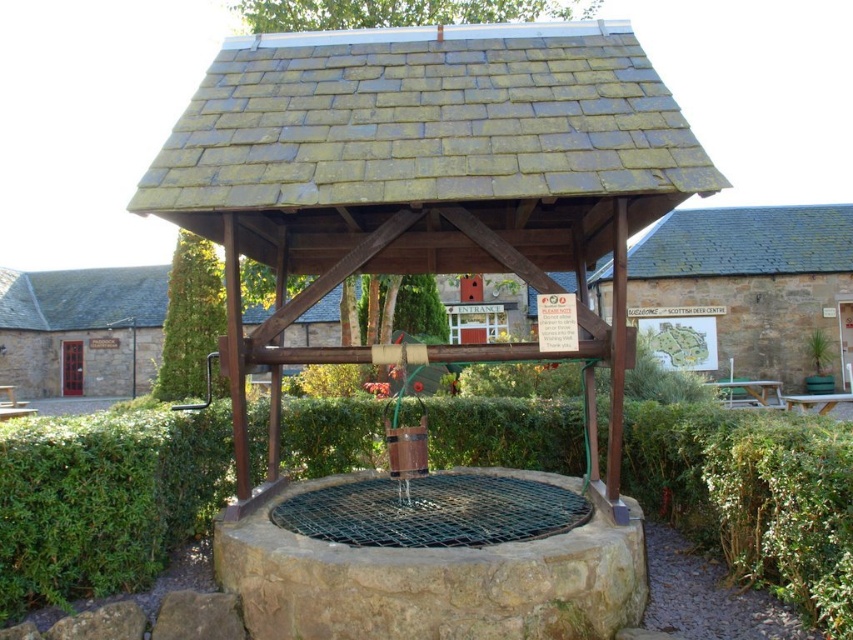
Which of these two, weathered wood gazebo at center or green leafy hedge at center, stands taller?

Standing taller between the two is weathered wood gazebo at center.

The image size is (853, 640). Find the location of `weathered wood gazebo at center`. weathered wood gazebo at center is located at coordinates tap(425, 180).

Is green leafy hedge at center bigger than green leafy bush at center?

No.

Can you confirm if green leafy hedge at center is positioned below green leafy bush at center?

Yes.

In the scene shown: Who is more distant from viewer, [502,440] or [189,321]?

The point [189,321] is behind.

Where is `green leafy hedge at center`? This screenshot has height=640, width=853. green leafy hedge at center is located at coordinates (103, 499).

Which is below, weathered wood gazebo at center or green leafy bush at center?

Positioned lower is green leafy bush at center.

Does weathered wood gazebo at center have a smaller size compared to green leafy bush at center?

Yes.

The width and height of the screenshot is (853, 640). Find the location of `weathered wood gazebo at center`. weathered wood gazebo at center is located at coordinates [x=425, y=180].